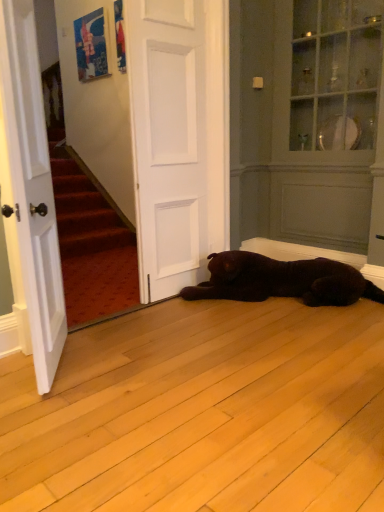
Find the location of a particular element. vacant area that lies between white wood door at left, which appears as the 2th door when viewed from the back, and white matte door at center, which is the 1th door from back to front is located at coordinates (125, 334).